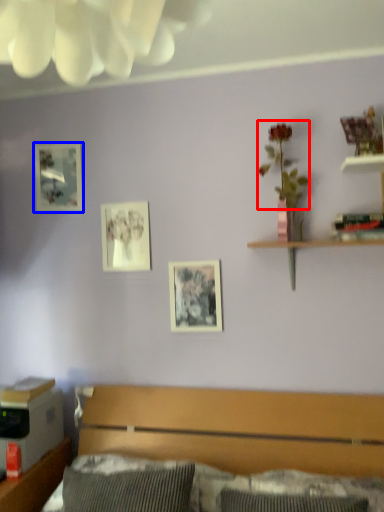
Question: Which point is closer to the camera, floral arrangement (highlighted by a red box) or picture frame (highlighted by a blue box)?

Choices:
 (A) floral arrangement
 (B) picture frame

Answer: (A)